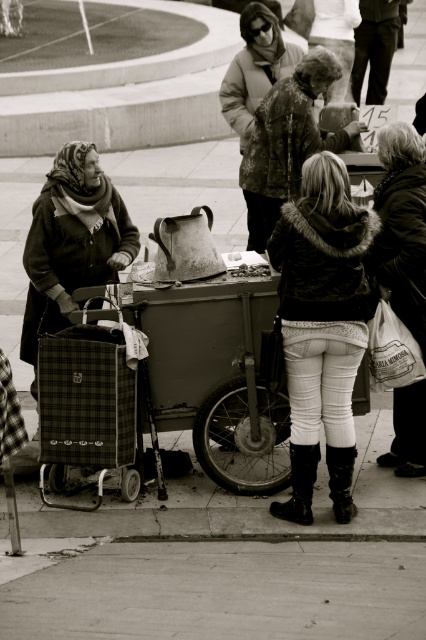
You are a delivery person who needs to place a 28 inch package between the white textured pants at center and the white textured bag at right. Can the package fit in the space between them?

The white textured pants at center and white textured bag at right are 28.32 inches apart from each other. Since the package is 28 inches long, it can fit in the space between them as the distance is slightly larger than the package.

You are a delivery person who needs to move the plaid fabric cart at center and the white textured bag at right to a storage area. Which object should you move first to avoid blocking the other?

You should move the plaid fabric cart at center first because it is in front of the white textured bag at right, so moving it first will prevent blocking access to the bag.